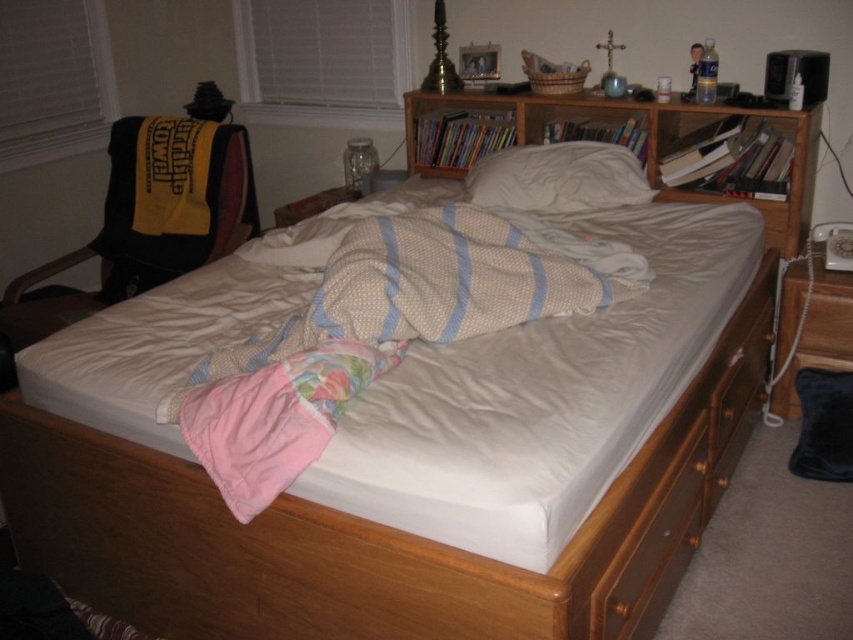
You are trying to find a place to put your phone in the bedroom. You see the wooden drawer at lower right and the white soft pillow at center. Which one is closer to the floor?

The wooden drawer at lower right is below the white soft pillow at center, so the wooden drawer at lower right is closer to the floor.

You are trying to decide where to place a new decorative item that requires a larger surface area. Based on the scene, which object between the wooden drawer at lower right and the white soft pillow at center would be more suitable for placing the item?

The wooden drawer at lower right is larger in size than the white soft pillow at center, so it would be more suitable for placing the decorative item that requires a larger surface area.

You are standing in the bedroom and need to place a small item into the wooden drawer at lower right. Based on the scene description, where should you look to find this drawer?

The wooden drawer at lower right is located at point 0.790 on the right side of the bed, so you should look towards the lower right area near the bed frame to find it.